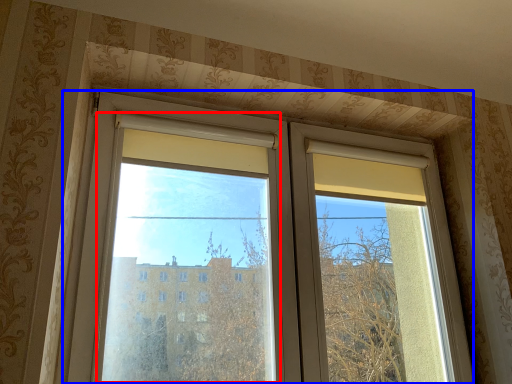
Question: Which of the following is the farthest to the observer, window screen (highlighted by a red box) or window (highlighted by a blue box)?

Choices:
 (A) window screen
 (B) window

Answer: (B)